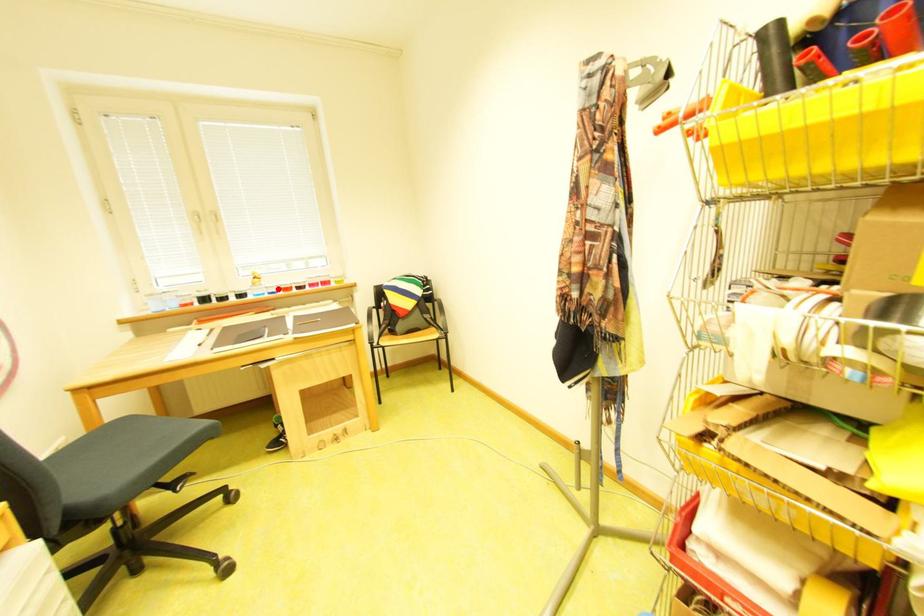
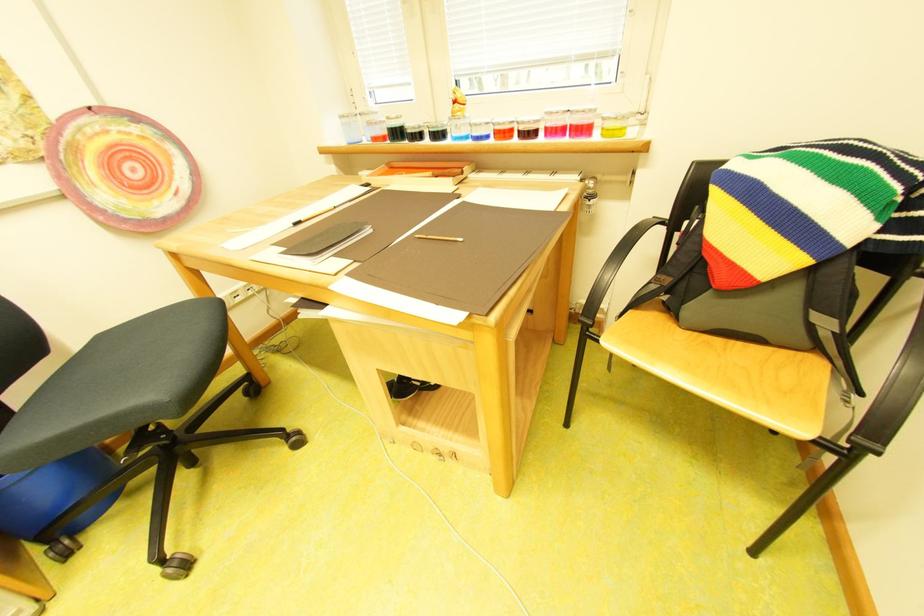
The point at the highlighted location is marked in the first image. Where is the corresponding point in the second image?

(481, 126)